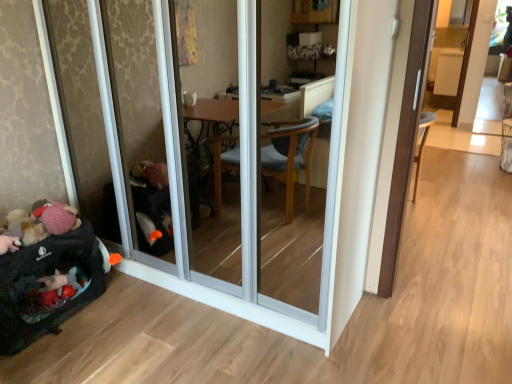
What do you see at coordinates (48, 275) in the screenshot?
I see `dark gray fabric baby carriage at lower left` at bounding box center [48, 275].

Find the location of `dark gray fabric baby carriage at lower left`. dark gray fabric baby carriage at lower left is located at coordinates (48, 275).

Measure the distance between point (91, 269) and camera.

The depth of point (91, 269) is 2.25 meters.

Find the location of a particular element. This screenshot has height=384, width=512. transparent glass screen door at left is located at coordinates (253, 189).

The height and width of the screenshot is (384, 512). Describe the element at coordinates (253, 189) in the screenshot. I see `transparent glass screen door at left` at that location.

Identify the location of dark gray fabric baby carriage at lower left. This screenshot has width=512, height=384. (48, 275).

Between dark gray fabric baby carriage at lower left and transparent glass screen door at left, which one appears on the left side from the viewer's perspective?

dark gray fabric baby carriage at lower left.

Considering the positions of objects dark gray fabric baby carriage at lower left and transparent glass screen door at left in the image provided, who is in front, dark gray fabric baby carriage at lower left or transparent glass screen door at left?

transparent glass screen door at left.

Does point (51, 320) lie behind point (336, 78)?

Yes, point (51, 320) is behind point (336, 78).

Based on the photo, from the image's perspective, is dark gray fabric baby carriage at lower left located above transparent glass screen door at left?

Incorrect, from the image's perspective, dark gray fabric baby carriage at lower left is lower than transparent glass screen door at left.

From a real-world perspective, is dark gray fabric baby carriage at lower left located beneath transparent glass screen door at left?

Yes.

Can you confirm if dark gray fabric baby carriage at lower left is thinner than transparent glass screen door at left?

Yes.

Is dark gray fabric baby carriage at lower left shorter than transparent glass screen door at left?

Indeed, dark gray fabric baby carriage at lower left has a lesser height compared to transparent glass screen door at left.

Considering the relative sizes of dark gray fabric baby carriage at lower left and transparent glass screen door at left in the image provided, is dark gray fabric baby carriage at lower left bigger than transparent glass screen door at left?

Actually, dark gray fabric baby carriage at lower left might be smaller than transparent glass screen door at left.

Is dark gray fabric baby carriage at lower left located outside transparent glass screen door at left?

dark gray fabric baby carriage at lower left is positioned outside transparent glass screen door at left.

Looking at this image, is dark gray fabric baby carriage at lower left beside transparent glass screen door at left?

No, dark gray fabric baby carriage at lower left is not next to transparent glass screen door at left.

Is dark gray fabric baby carriage at lower left oriented towards transparent glass screen door at left?

No, dark gray fabric baby carriage at lower left is not oriented towards transparent glass screen door at left.

How distant is dark gray fabric baby carriage at lower left from transparent glass screen door at left?

22.96 inches.

Where is `screen door above the dark gray fabric baby carriage at lower left (from a real-world perspective)`? screen door above the dark gray fabric baby carriage at lower left (from a real-world perspective) is located at coordinates (253, 189).

Considering the positions of objects transparent glass screen door at left and dark gray fabric baby carriage at lower left in the image provided, who is more to the right, transparent glass screen door at left or dark gray fabric baby carriage at lower left?

transparent glass screen door at left is more to the right.

From the picture: Considering the relative positions of transparent glass screen door at left and dark gray fabric baby carriage at lower left in the image provided, is transparent glass screen door at left in front of dark gray fabric baby carriage at lower left?

Yes, it is in front of dark gray fabric baby carriage at lower left.

Does point (248, 240) lie behind point (102, 282)?

No, it is not.

From the image's perspective, is transparent glass screen door at left positioned above or below dark gray fabric baby carriage at lower left?

From the image's perspective, transparent glass screen door at left appears above dark gray fabric baby carriage at lower left.

From a real-world perspective, is transparent glass screen door at left below dark gray fabric baby carriage at lower left?

No, from a real-world perspective, transparent glass screen door at left is not under dark gray fabric baby carriage at lower left.

Which object is wider, transparent glass screen door at left or dark gray fabric baby carriage at lower left?

Wider between the two is transparent glass screen door at left.

From the picture: Is transparent glass screen door at left shorter than dark gray fabric baby carriage at lower left?

No, transparent glass screen door at left is not shorter than dark gray fabric baby carriage at lower left.

Which of these two, transparent glass screen door at left or dark gray fabric baby carriage at lower left, is bigger?

With larger size is transparent glass screen door at left.

Is transparent glass screen door at left not inside dark gray fabric baby carriage at lower left?

Absolutely, transparent glass screen door at left is external to dark gray fabric baby carriage at lower left.

Is transparent glass screen door at left far from dark gray fabric baby carriage at lower left?

That's not correct — transparent glass screen door at left is a little close to dark gray fabric baby carriage at lower left.

Based on the photo, is transparent glass screen door at left turned away from dark gray fabric baby carriage at lower left?

transparent glass screen door at left is not turned away from dark gray fabric baby carriage at lower left.

What's the angular difference between transparent glass screen door at left and dark gray fabric baby carriage at lower left's facing directions?

transparent glass screen door at left and dark gray fabric baby carriage at lower left are facing 87.6 degrees away from each other.

What are the coordinates of `baby carriage that is below the transparent glass screen door at left (from the image's perspective)` in the screenshot? It's located at (48, 275).

The height and width of the screenshot is (384, 512). Identify the location of baby carriage that is behind the transparent glass screen door at left. (48, 275).

Identify the location of screen door lying in front of the dark gray fabric baby carriage at lower left. The width and height of the screenshot is (512, 384). (253, 189).